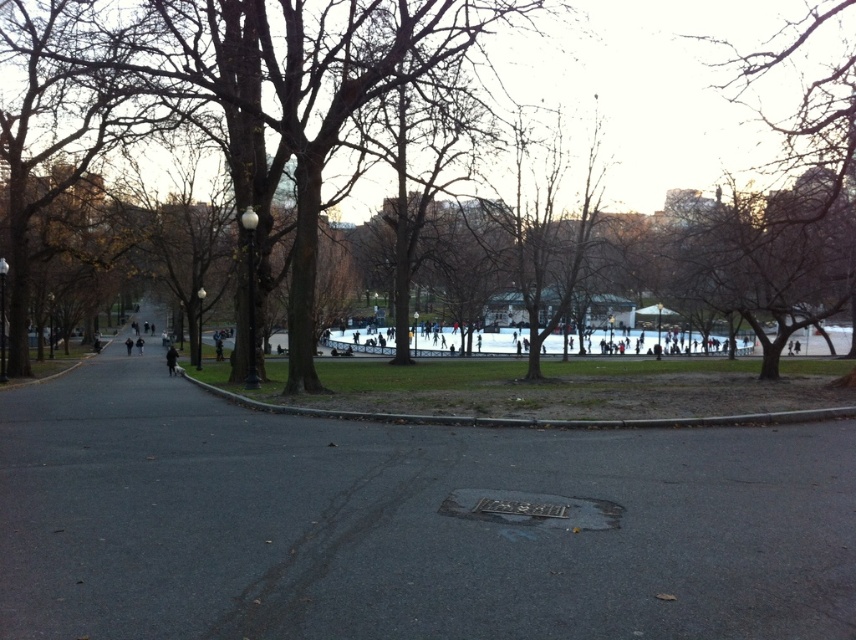
Question: Is brown bark tree at center further to camera compared to black coat at center?

Choices:
 (A) yes
 (B) no

Answer: (B)

Question: Estimate the real-world distances between objects in this image. Which object is closer to the brown bark tree at center?

Choices:
 (A) dark asphalt pavement at center
 (B) black coat at center

Answer: (A)

Question: Is the position of dark asphalt pavement at center less distant than that of black coat at center?

Choices:
 (A) yes
 (B) no

Answer: (A)

Question: Which point is farther to the camera?

Choices:
 (A) black coat at center
 (B) dark asphalt pavement at center

Answer: (A)

Question: Does dark asphalt pavement at center have a smaller size compared to brown bark tree at center?

Choices:
 (A) no
 (B) yes

Answer: (B)

Question: Estimate the real-world distances between objects in this image. Which object is closer to the dark asphalt pavement at center?

Choices:
 (A) black coat at center
 (B) brown bark tree at center

Answer: (B)